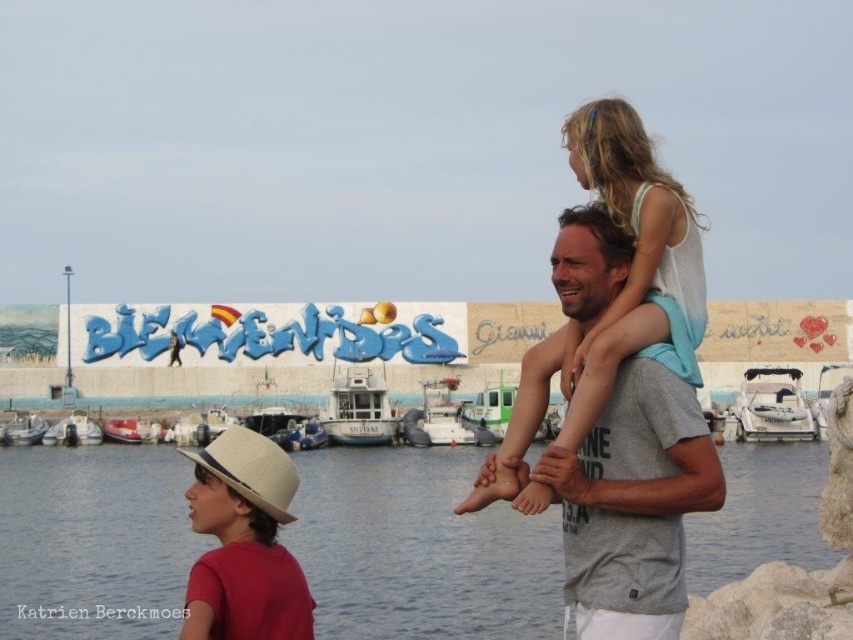
You are standing at the origin point of the image. Where is the clear water at lower center located in terms of coordinates?

The clear water at lower center is located at coordinates point (419, 550).